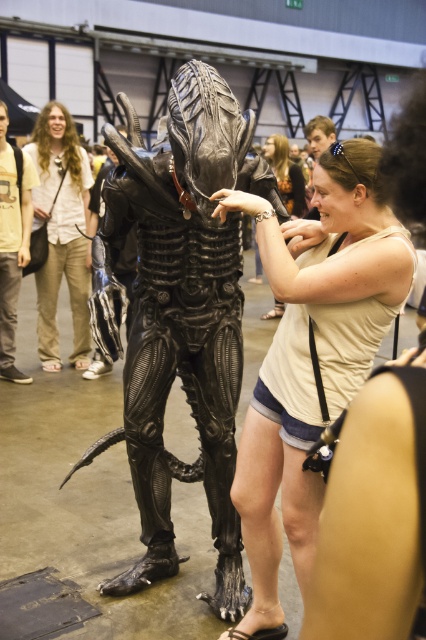
Does black matte alien at center have a lesser width compared to matte black tank top at center?

No, black matte alien at center is not thinner than matte black tank top at center.

Is point (216, 184) positioned after point (255, 253)?

No, it is not.

Between point (150, 236) and point (284, 148), which one is positioned in front?

Point (150, 236) is in front.

At what (x,y) coordinates should I click in order to perform the action: click on black matte alien at center. Please return your answer as a coordinate pair (x, y). This screenshot has height=640, width=426. Looking at the image, I should click on (178, 314).

Does black matte alien at center have a larger size compared to yellow t-shirt at left?

Yes, black matte alien at center is bigger than yellow t-shirt at left.

Who is positioned more to the left, black matte alien at center or yellow t-shirt at left?

Answer: yellow t-shirt at left is more to the left.

The image size is (426, 640). In order to click on black matte alien at center in this screenshot , I will do `click(178, 314)`.

The image size is (426, 640). Identify the location of black matte alien at center. (178, 314).

Which is more to the left, white matte tank top at center or matte black tank top at center?

white matte tank top at center

Does white matte tank top at center appear on the left side of matte black tank top at center?

Yes, white matte tank top at center is to the left of matte black tank top at center.

Who is more distant from viewer, (291, 362) or (268, 134)?

Positioned behind is point (268, 134).

I want to click on white matte tank top at center, so click(319, 362).